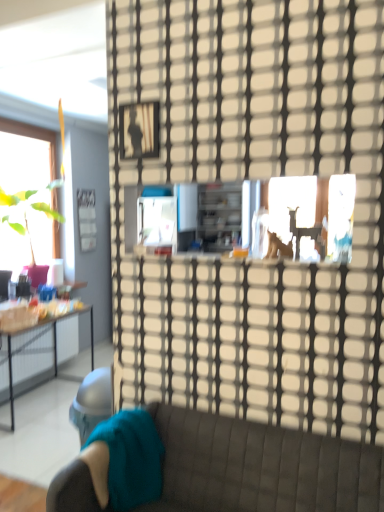
Question: From a real-world perspective, is velvet teal studio couch at lower left under transparent glass door at center?

Choices:
 (A) yes
 (B) no

Answer: (A)

Question: Does velvet teal studio couch at lower left turn towards transparent glass door at center?

Choices:
 (A) no
 (B) yes

Answer: (A)

Question: Would you say velvet teal studio couch at lower left is a long distance from transparent glass door at center?

Choices:
 (A) no
 (B) yes

Answer: (A)

Question: Is velvet teal studio couch at lower left closer to the viewer compared to transparent glass door at center?

Choices:
 (A) yes
 (B) no

Answer: (A)

Question: Considering the relative sizes of velvet teal studio couch at lower left and transparent glass door at center in the image provided, is velvet teal studio couch at lower left bigger than transparent glass door at center?

Choices:
 (A) yes
 (B) no

Answer: (A)

Question: Based on their sizes in the image, would you say metallic silver picture frame at upper center is bigger or smaller than transparent glass door at center?

Choices:
 (A) small
 (B) big

Answer: (A)

Question: Considering the positions of point (139, 113) and point (153, 392), is point (139, 113) closer or farther from the camera than point (153, 392)?

Choices:
 (A) closer
 (B) farther

Answer: (A)

Question: In the image, is metallic silver picture frame at upper center on the left side or the right side of transparent glass door at center?

Choices:
 (A) left
 (B) right

Answer: (A)

Question: Is metallic silver picture frame at upper center inside or outside of transparent glass door at center?

Choices:
 (A) inside
 (B) outside

Answer: (A)

Question: Looking at their shapes, would you say transparent glass door at center is wider or thinner than metallic silver picture frame at upper center?

Choices:
 (A) wide
 (B) thin

Answer: (A)

Question: In terms of height, does transparent glass door at center look taller or shorter compared to metallic silver picture frame at upper center?

Choices:
 (A) short
 (B) tall

Answer: (B)

Question: From a real-world perspective, is transparent glass door at center physically located above or below metallic silver picture frame at upper center?

Choices:
 (A) below
 (B) above

Answer: (A)

Question: From the image's perspective, relative to metallic silver picture frame at upper center, is transparent glass door at center above or below?

Choices:
 (A) below
 (B) above

Answer: (A)

Question: From the image's perspective, is teal fabric pillow at lower left located above or below velvet teal studio couch at lower left?

Choices:
 (A) above
 (B) below

Answer: (A)

Question: Relative to velvet teal studio couch at lower left, is teal fabric pillow at lower left in front or behind?

Choices:
 (A) front
 (B) behind

Answer: (B)